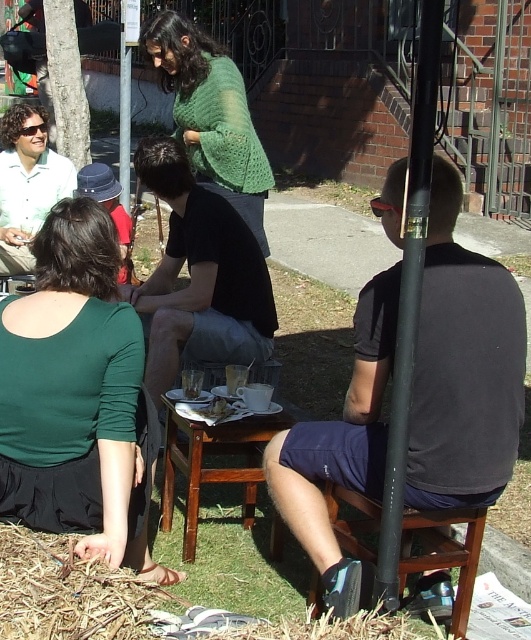
Question: Estimate the real-world distances between objects in this image. Which object is closer to the green knitted sweater at center?

Choices:
 (A) woodenobject at center
 (B) black matte pole at right

Answer: (A)

Question: Is green knitted sweater at center bigger than wooden stool at lower right?

Choices:
 (A) yes
 (B) no

Answer: (A)

Question: Can you confirm if green matte shirt at lower left is positioned above woodenobject at center?

Choices:
 (A) no
 (B) yes

Answer: (B)

Question: Can you confirm if green matte shirt at lower left is wider than black matte pole at right?

Choices:
 (A) yes
 (B) no

Answer: (A)

Question: Which of the following is the closest to the observer?

Choices:
 (A) woodenobject at center
 (B) wooden stool at lower right

Answer: (B)

Question: Which point appears farthest from the camera in this image?

Choices:
 (A) (417, 74)
 (B) (64, 560)

Answer: (B)